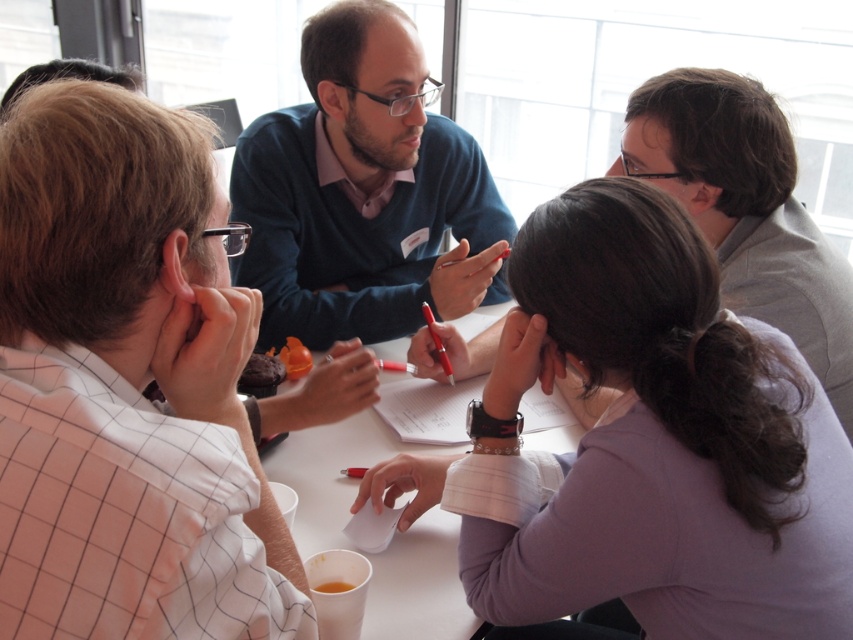
Question: Among these objects, which one is nearest to the camera?

Choices:
 (A) dark blue sweater at center
 (B) white paper at center

Answer: (B)

Question: Estimate the real-world distances between objects in this image. Which object is farther from the white checkered shirt at left?

Choices:
 (A) dark blue sweater at center
 (B) chocolate cake at lower center

Answer: (A)

Question: Considering the relative positions of matte blue sweater at upper center and white paper at center in the image provided, where is matte blue sweater at upper center located with respect to white paper at center?

Choices:
 (A) left
 (B) right

Answer: (B)

Question: Does white checkered shirt at left appear on the left side of white paper at center?

Choices:
 (A) no
 (B) yes

Answer: (B)

Question: Is white checkered shirt at left thinner than white paper at center?

Choices:
 (A) yes
 (B) no

Answer: (A)

Question: Which object appears closest to the camera in this image?

Choices:
 (A) dark blue sweater at center
 (B) chocolate cake at lower center
 (C) white checkered shirt at left
 (D) matte blue sweater at upper center

Answer: (C)